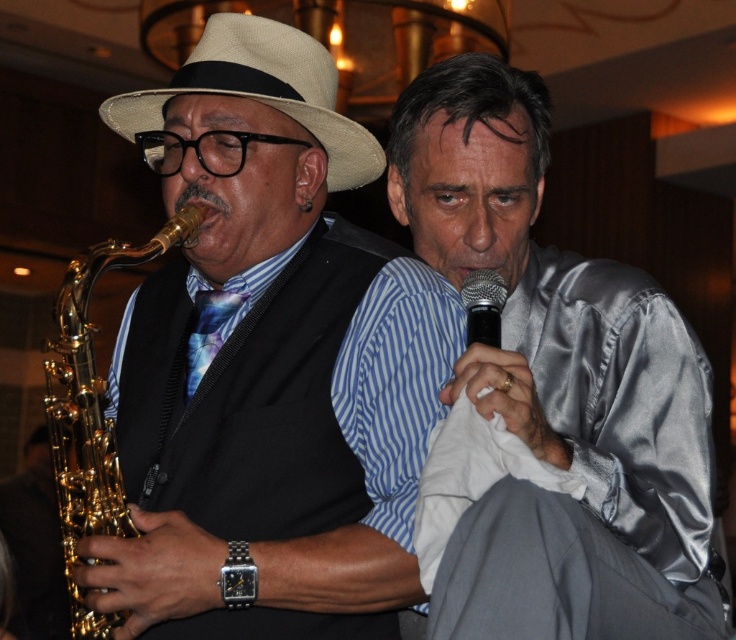
Is silver satin shirt at right further to camera compared to gold shiny saxophone at left?

Yes, it is.

Can you confirm if silver satin shirt at right is wider than gold shiny saxophone at left?

Yes.

You are a GUI agent. You are given a task and a screenshot of the screen. Output one action in this format:
    pyautogui.click(x=<x>, y=<y>)
    Task: Click on the silver satin shirt at right
    
    Given the screenshot: What is the action you would take?
    pyautogui.click(x=559, y=388)

Between point (413, 385) and point (463, 298), which one is positioned behind?

The point (463, 298) is more distant.

Is point (328, 429) positioned after point (503, 294)?

No.

Locate an element on the screen. shiny gold saxophone at left is located at coordinates (269, 364).

Can you confirm if gold shiny saxophone at left is positioned above black metallic microphone at center?

No.

Can you confirm if gold shiny saxophone at left is wider than black metallic microphone at center?

Yes.

The height and width of the screenshot is (640, 736). Find the location of `gold shiny saxophone at left`. gold shiny saxophone at left is located at coordinates (92, 412).